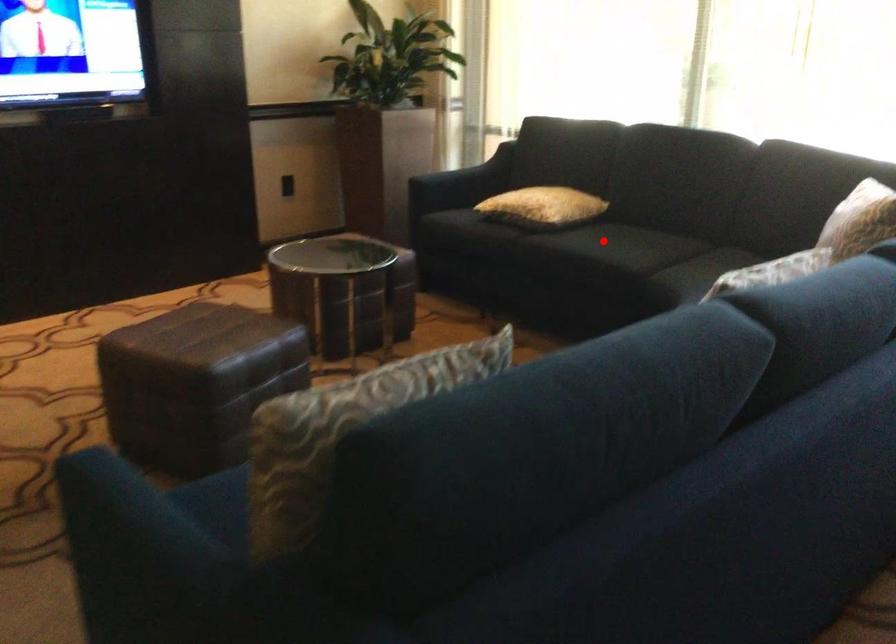
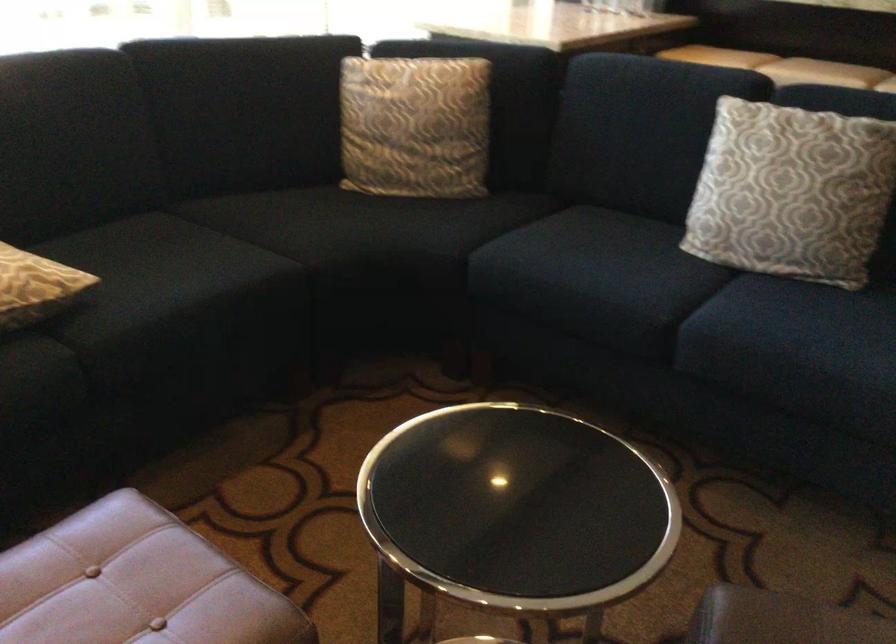
Find the pixel in the second image that matches the highlighted location in the first image.

(161, 270)